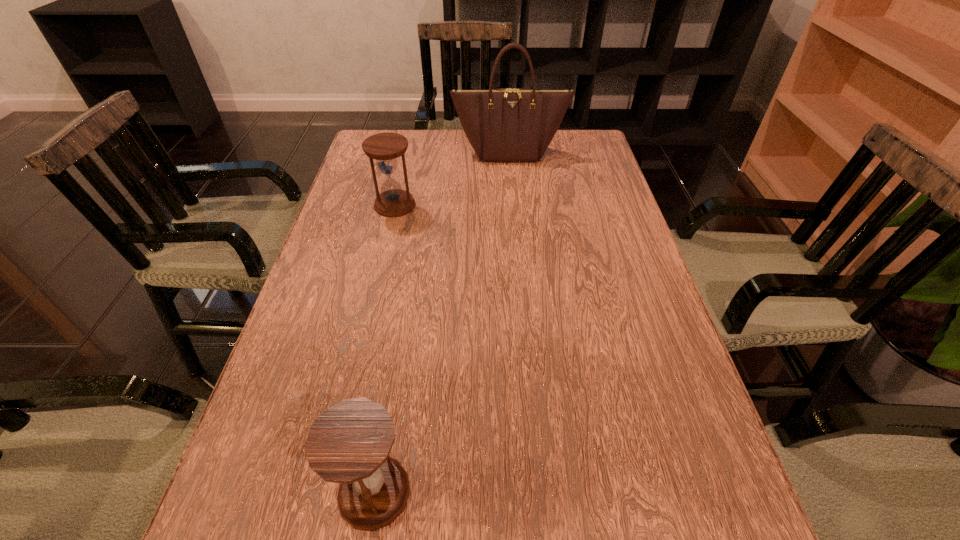
This screenshot has width=960, height=540. Find the location of `free region at the far edge of the desktop`. free region at the far edge of the desktop is located at coordinates pos(436,165).

Find the location of `vacant space at the left edge`. vacant space at the left edge is located at coordinates (228, 510).

Where is `blank space at the right edge of the desktop`? blank space at the right edge of the desktop is located at coordinates tap(635, 334).

At what (x,y) coordinates should I click in order to perform the action: click on vacant area that lies between the second nearest object and the handbag. Please return your answer as a coordinate pair (x, y). The image size is (960, 540). Looking at the image, I should click on (452, 179).

Locate an element on the screen. This screenshot has width=960, height=540. free area in between the nearer hourglass and the second nearest object is located at coordinates (385, 348).

Image resolution: width=960 pixels, height=540 pixels. Identify the location of unoccupied position between the nearest object and the handbag. (442, 322).

Find the location of a particular element. Image resolution: width=960 pixels, height=540 pixels. free area in between the second nearest object and the tallest object is located at coordinates click(x=452, y=179).

Identify the location of free space that is in between the nearer hourglass and the handbag. (442, 322).

Find the location of a particular element. Image resolution: width=960 pixels, height=540 pixels. free space between the farther hourglass and the tallest object is located at coordinates (452, 179).

Find the location of a particular element. Image resolution: width=960 pixels, height=540 pixels. vacant area between the second farthest object and the rightmost object is located at coordinates (452, 179).